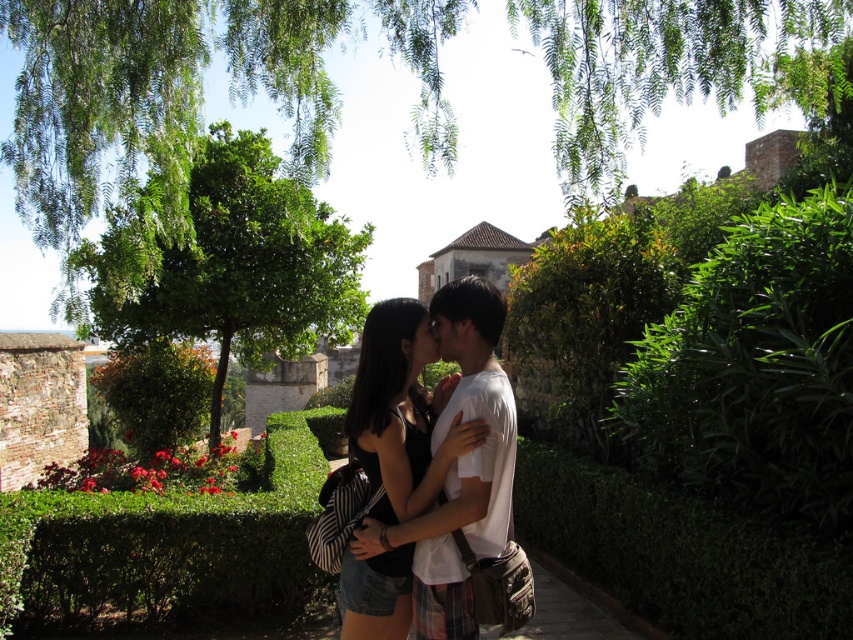
Question: Among these objects, which one is nearest to the camera?

Choices:
 (A) green leafy tree at upper center
 (B) green leafy tree at center

Answer: (A)

Question: Is green leafy tree at center to the right of matte black dress at center from the viewer's perspective?

Choices:
 (A) yes
 (B) no

Answer: (B)

Question: Which object is farther from the camera taking this photo?

Choices:
 (A) green leafy tree at upper center
 (B) green leafy tree at center

Answer: (B)

Question: Can you confirm if green leafy tree at upper center is positioned to the right of matte black dress at center?

Choices:
 (A) yes
 (B) no

Answer: (B)

Question: Does green leafy tree at upper center come in front of green leafy tree at center?

Choices:
 (A) no
 (B) yes

Answer: (B)

Question: Considering the real-world distances, which object is farthest from the matte black dress at center?

Choices:
 (A) green leafy tree at upper center
 (B) green leafy tree at center

Answer: (B)